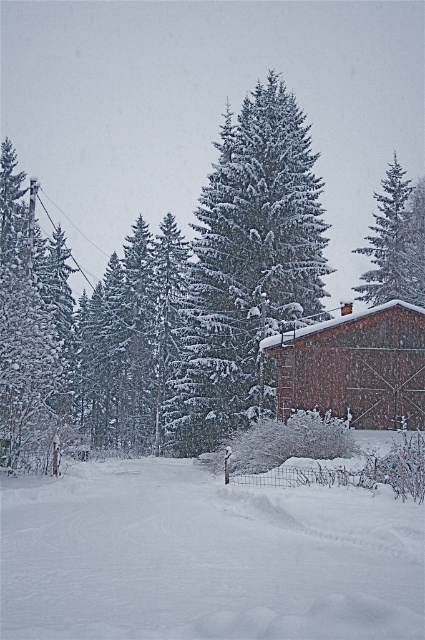
Question: Which of the following is the farthest from the observer?

Choices:
 (A) (257, 140)
 (B) (385, 326)
 (C) (410, 241)
 (D) (231, 525)

Answer: (C)

Question: Which object is the farthest from the snow-covered evergreen tree at center?

Choices:
 (A) snow-covered pine tree at upper right
 (B) brown wooden cabin at center-right
 (C) white snow ski slope at center

Answer: (C)

Question: Where is brown wooden cabin at center-right located in relation to snow-covered pine tree at upper right in the image?

Choices:
 (A) below
 (B) above

Answer: (A)

Question: Which point appears closest to the camera in this image?

Choices:
 (A) (399, 532)
 (B) (274, 140)

Answer: (A)

Question: Is white snow ski slope at center thinner than snow-covered pine tree at upper right?

Choices:
 (A) no
 (B) yes

Answer: (B)

Question: Is the position of white snow ski slope at center less distant than that of snow-covered evergreen tree at center?

Choices:
 (A) yes
 (B) no

Answer: (A)